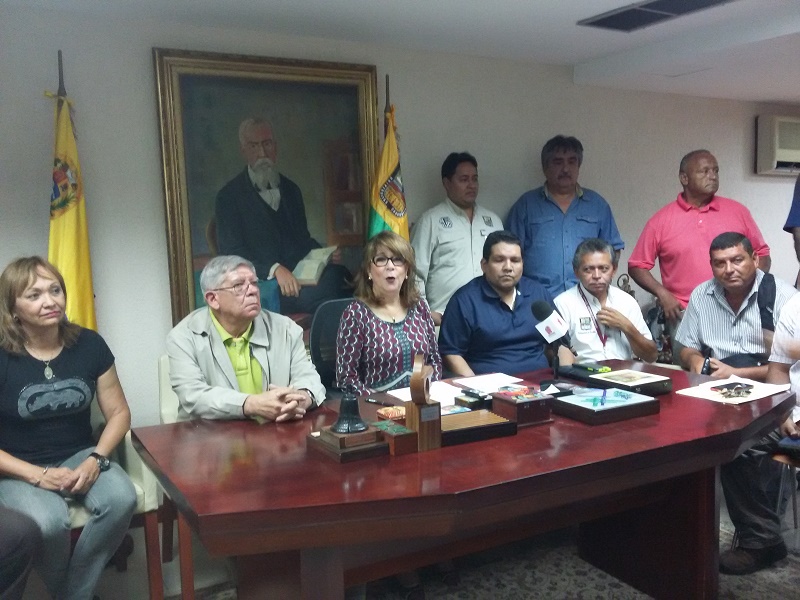
Find the location of a particular element. floor is located at coordinates (542, 563).